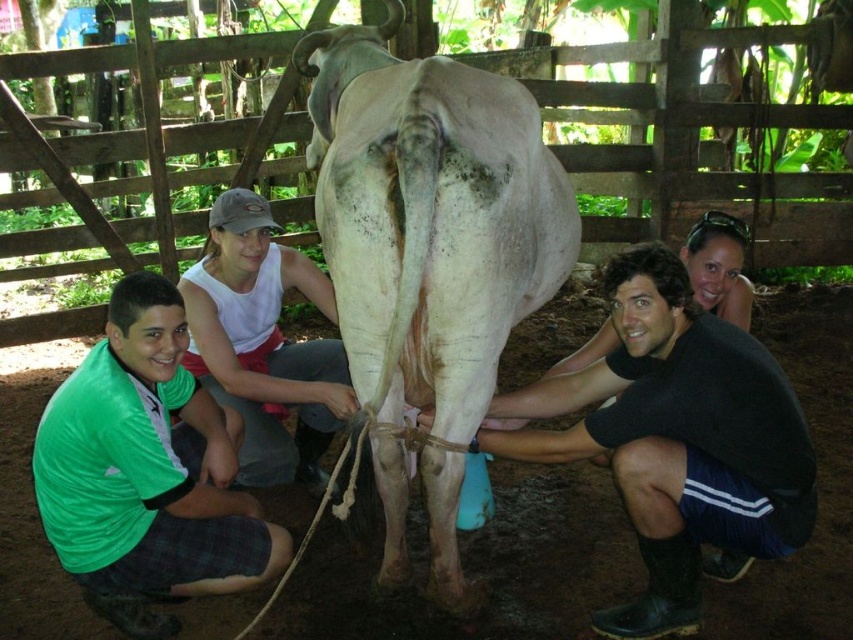
Does black rubber boots at lower right have a larger size compared to green fabric shirt at center?

Actually, black rubber boots at lower right might be smaller than green fabric shirt at center.

Is black rubber boots at lower right above green fabric shirt at center?

No, black rubber boots at lower right is not above green fabric shirt at center.

Find the location of `black rubber boots at lower right`. black rubber boots at lower right is located at coordinates (676, 438).

This screenshot has height=640, width=853. What do you see at coordinates (430, 218) in the screenshot?
I see `white matte cow at center` at bounding box center [430, 218].

Is point (427, 513) closer to viewer compared to point (105, 458)?

No.

Describe the element at coordinates (430, 218) in the screenshot. I see `white matte cow at center` at that location.

Locate an element on the screen. white matte cow at center is located at coordinates (430, 218).

Who is lower down, black rubber boots at lower right or green fabric shirt at lower left?

green fabric shirt at lower left

Describe the element at coordinates (676, 438) in the screenshot. I see `black rubber boots at lower right` at that location.

Find the location of a particular element. black rubber boots at lower right is located at coordinates (676, 438).